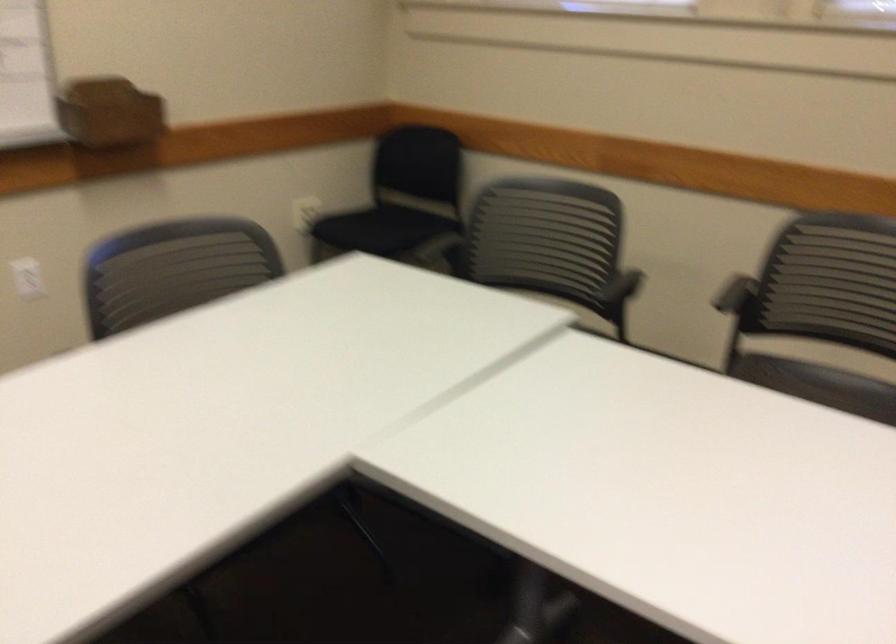
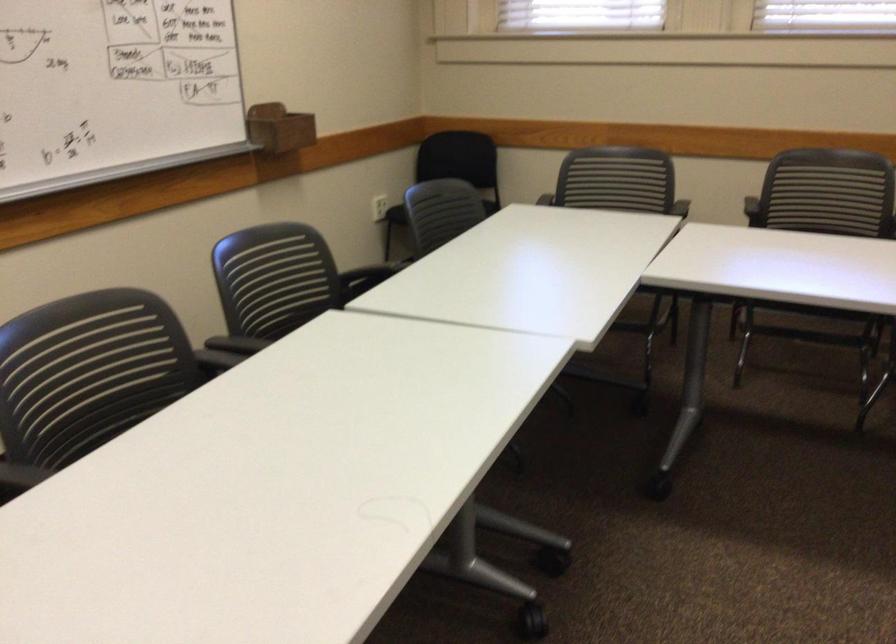
The point at (106,100) is marked in the first image. Where is the corresponding point in the second image?

(279, 128)